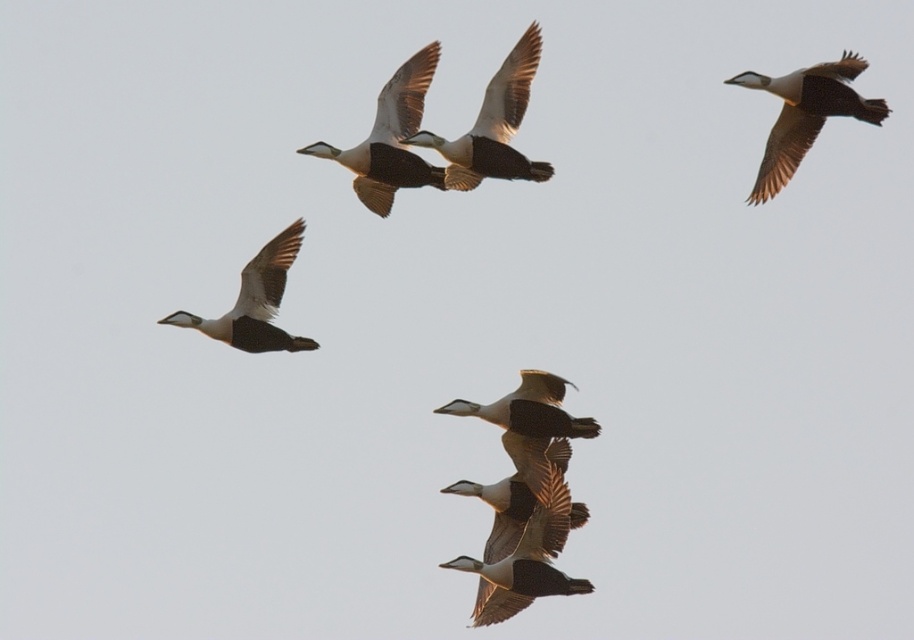
Question: Estimate the real-world distances between objects in this image. Which object is closer to the white matte goose at left?

Choices:
 (A) white-feathered duck at upper right
 (B) white glossy duck at center

Answer: (B)

Question: Does white glossy goose at upper center have a greater width compared to white matte goose at left?

Choices:
 (A) yes
 (B) no

Answer: (B)

Question: Based on their relative distances, which object is nearer to the white glossy goose at upper center?

Choices:
 (A) white glossy duck at center
 (B) white-feathered duck at center

Answer: (B)

Question: Considering the relative positions of white glossy goose at upper center and white-feathered duck at center in the image provided, where is white glossy goose at upper center located with respect to white-feathered duck at center?

Choices:
 (A) right
 (B) left

Answer: (B)

Question: Can you confirm if white-feathered duck at upper right is wider than white glossy duck at center?

Choices:
 (A) no
 (B) yes

Answer: (A)

Question: Which point is closer to the camera?

Choices:
 (A) white-feathered duck at upper right
 (B) white glossy goose at upper center

Answer: (A)